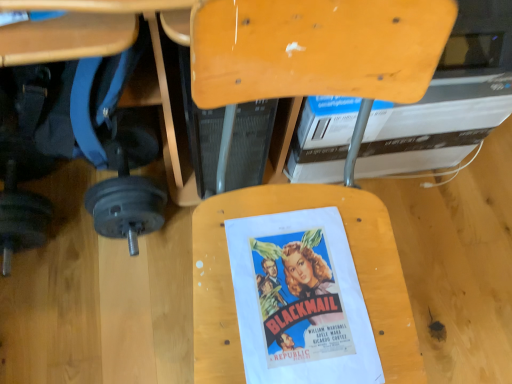
Question: Is matte paper movie poster at center to the right of white cardboard book at upper center from the viewer's perspective?

Choices:
 (A) yes
 (B) no

Answer: (B)

Question: From the image's perspective, does matte paper movie poster at center appear higher than white cardboard book at upper center?

Choices:
 (A) no
 (B) yes

Answer: (A)

Question: Is matte paper movie poster at center completely or partially outside of white cardboard book at upper center?

Choices:
 (A) no
 (B) yes

Answer: (B)

Question: Considering the relative sizes of matte paper movie poster at center and white cardboard book at upper center in the image provided, is matte paper movie poster at center bigger than white cardboard book at upper center?

Choices:
 (A) yes
 (B) no

Answer: (B)

Question: From a real-world perspective, does matte paper movie poster at center sit lower than white cardboard book at upper center?

Choices:
 (A) yes
 (B) no

Answer: (B)

Question: From a real-world perspective, is brushed metal dumbbell at lower left physically located above or below wooden chair at center?

Choices:
 (A) above
 (B) below

Answer: (B)

Question: Considering the positions of brushed metal dumbbell at lower left and wooden chair at center in the image, is brushed metal dumbbell at lower left bigger or smaller than wooden chair at center?

Choices:
 (A) big
 (B) small

Answer: (B)

Question: In the image, is brushed metal dumbbell at lower left positioned in front of or behind wooden chair at center?

Choices:
 (A) front
 (B) behind

Answer: (B)

Question: Visually, is brushed metal dumbbell at lower left positioned to the left or to the right of wooden chair at center?

Choices:
 (A) left
 (B) right

Answer: (A)

Question: Is point (258, 201) closer or farther from the camera than point (52, 23)?

Choices:
 (A) closer
 (B) farther

Answer: (B)

Question: In the image, is wooden chair at center positioned in front of or behind brushed metal dumbbell at lower left?

Choices:
 (A) behind
 (B) front

Answer: (B)

Question: From the image's perspective, is wooden chair at center positioned above or below brushed metal dumbbell at lower left?

Choices:
 (A) above
 (B) below

Answer: (B)

Question: From a real-world perspective, is wooden chair at center above or below brushed metal dumbbell at lower left?

Choices:
 (A) below
 (B) above

Answer: (B)

Question: From a real-world perspective, relative to white cardboard book at upper center, is matte paper movie poster at center vertically above or below?

Choices:
 (A) above
 (B) below

Answer: (A)

Question: Looking at the image, does matte paper movie poster at center seem bigger or smaller compared to white cardboard book at upper center?

Choices:
 (A) small
 (B) big

Answer: (A)